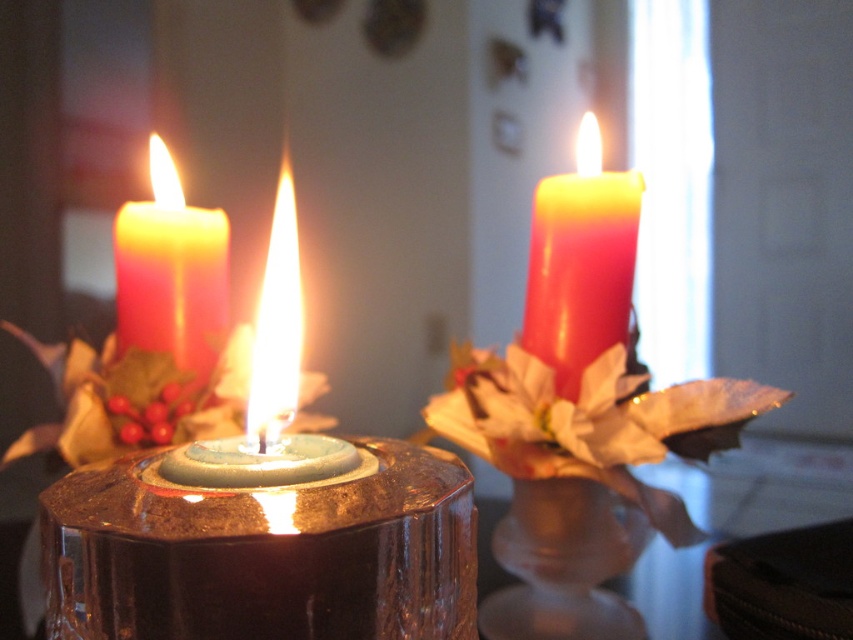
You are arranging flowers on a table and need to place a vase between the glossy glass candle holder at center and the matte red candle at right. Based on their positions, where should the vase be placed?

The glossy glass candle holder at center is located below the matte red candle at right, so the vase should be placed between them vertically. Since the candle holder is below, the vase should be placed above the glossy glass candle holder at center and below the matte red candle at right to maintain the vertical arrangement.